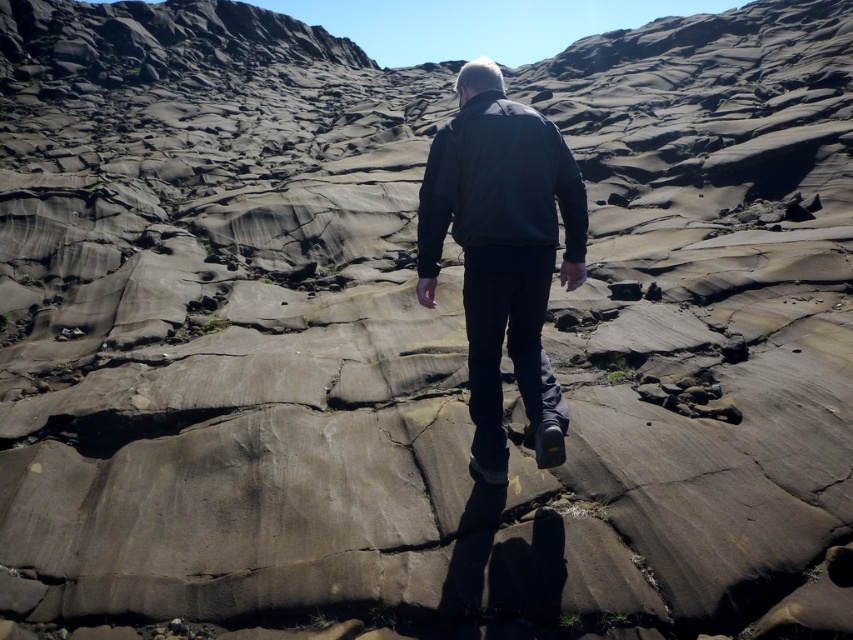
Between point (465, 253) and point (566, 243), which one is positioned behind?

The point (566, 243) is more distant.

Is the position of dark gray jacket at center less distant than that of dark gray matte jacket at center?

No, dark gray jacket at center is behind dark gray matte jacket at center.

This screenshot has width=853, height=640. What are the coordinates of `dark gray jacket at center` in the screenshot? It's located at (503, 252).

Where is `dark gray jacket at center`? The height and width of the screenshot is (640, 853). dark gray jacket at center is located at coordinates (503, 252).